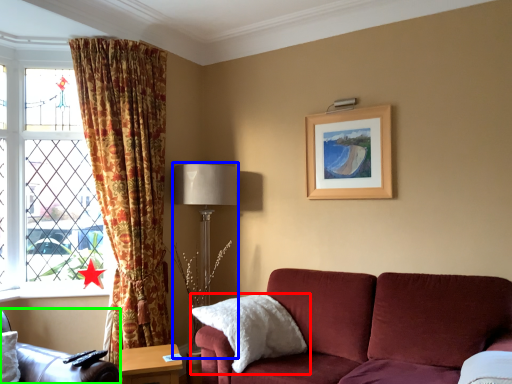
Question: Which object is positioned farthest from pillow (highlighted by a red box)? Select from table lamp (highlighted by a blue box) and chair (highlighted by a green box).

Choices:
 (A) table lamp
 (B) chair

Answer: (B)